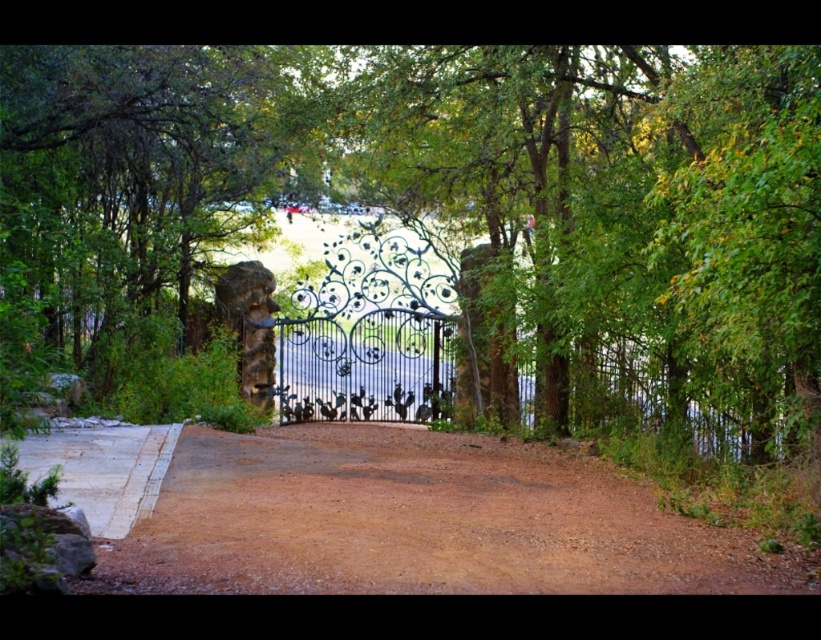
Question: Which of the following is the closest to the observer?

Choices:
 (A) green leafy tree at left
 (B) green leafy tree at center
 (C) wrought iron gate at center

Answer: (B)

Question: Does brown gravel driveway at center appear on the left side of green leafy tree at left?

Choices:
 (A) yes
 (B) no

Answer: (B)

Question: Can you confirm if green leafy tree at left is positioned below wrought iron gate at center?

Choices:
 (A) no
 (B) yes

Answer: (A)

Question: Which of the following is the closest to the observer?

Choices:
 (A) (106, 314)
 (B) (612, 424)
 (C) (384, 502)
 (D) (618, 90)

Answer: (C)

Question: Considering the real-world distances, which object is farthest from the wrought iron gate at center?

Choices:
 (A) green leafy tree at left
 (B) green leafy tree at center

Answer: (A)

Question: Is green leafy tree at center to the left of green leafy tree at left from the viewer's perspective?

Choices:
 (A) no
 (B) yes

Answer: (A)